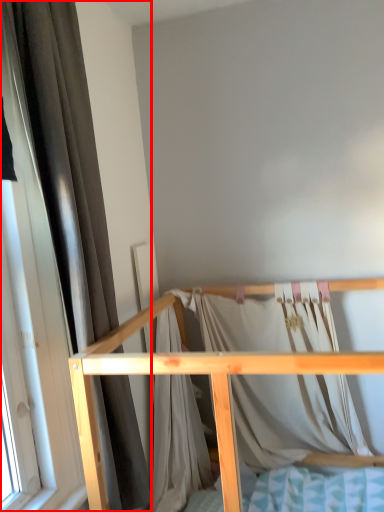
Question: From the image's perspective, what is the correct spatial relationship of curtain (annotated by the red box) in relation to furniture?

Choices:
 (A) below
 (B) above

Answer: (B)